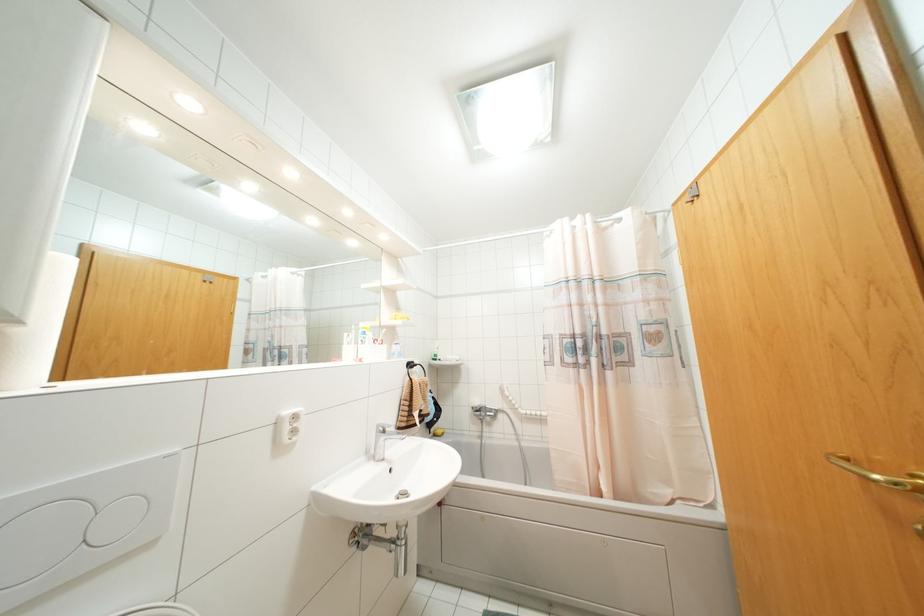
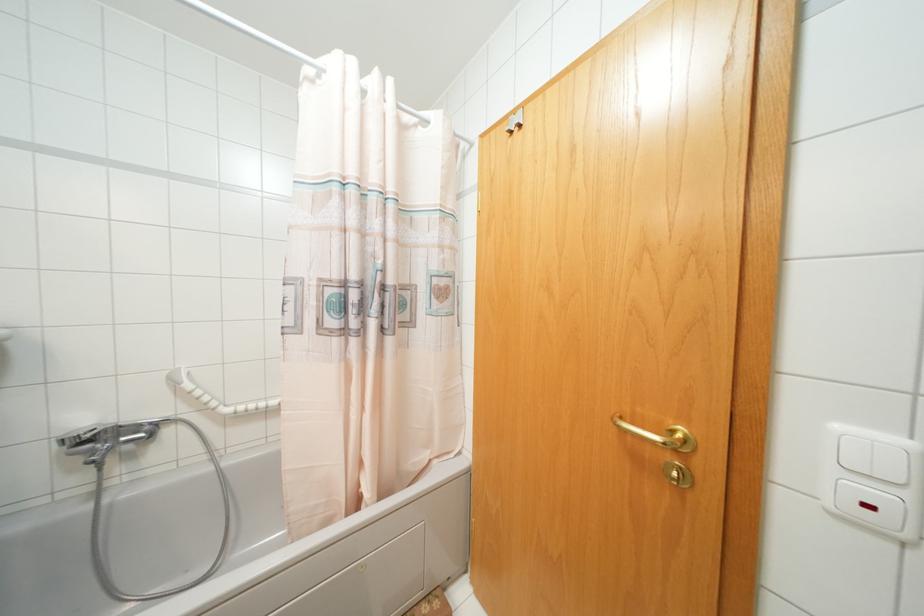
Question: The camera is either moving clockwise (left) or counter-clockwise (right) around the object. The first image is from the beginning of the video and the second image is from the end. Is the camera moving left or right when shooting the video?

Choices:
 (A) Left
 (B) Right

Answer: (A)